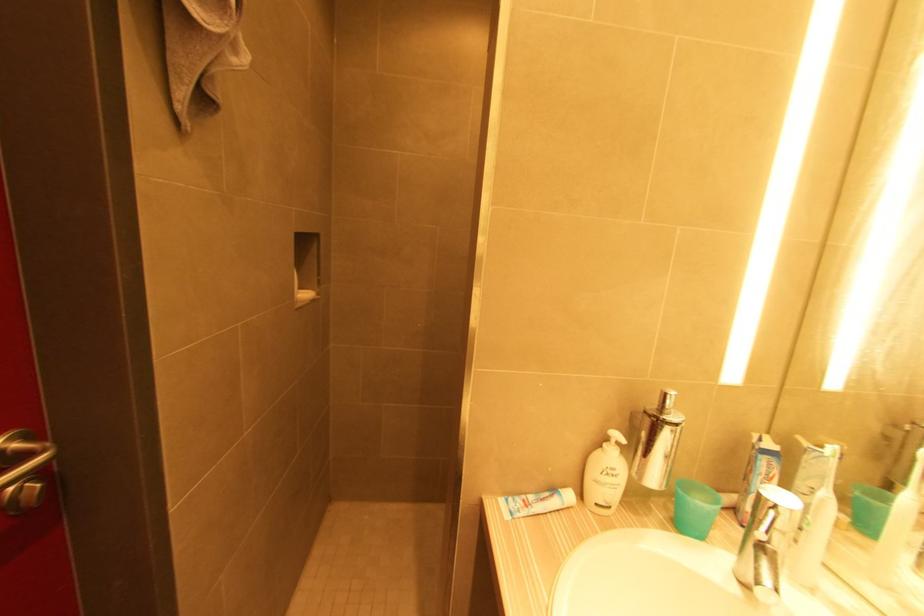
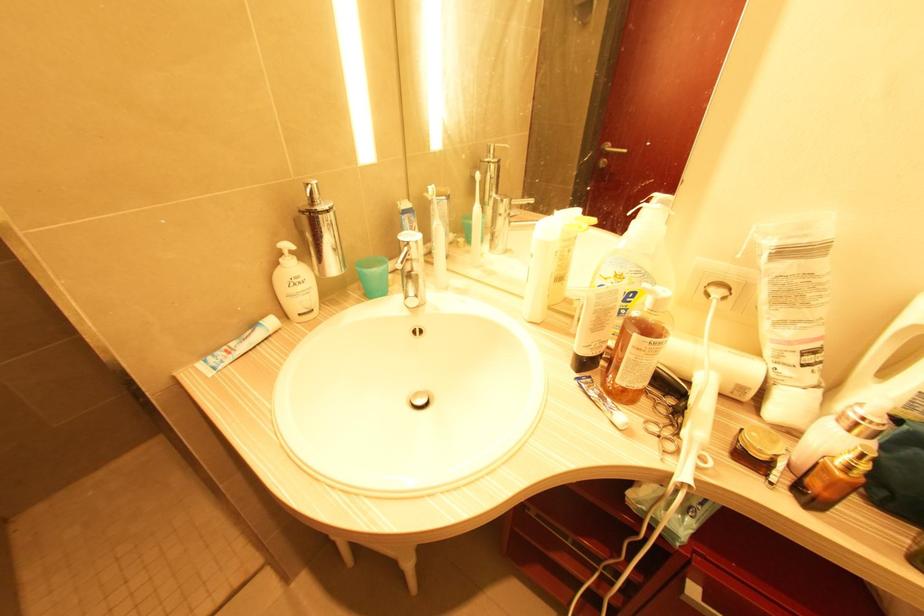
Find the pixel in the second image that matches point 602,448 in the first image.

(280, 265)